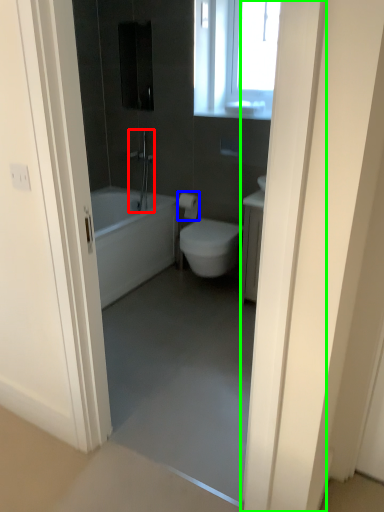
Question: Which object is the closest to the shower (highlighted by a red box)? Choose among these: toilet paper (highlighted by a blue box) or door (highlighted by a green box).

Choices:
 (A) toilet paper
 (B) door

Answer: (A)